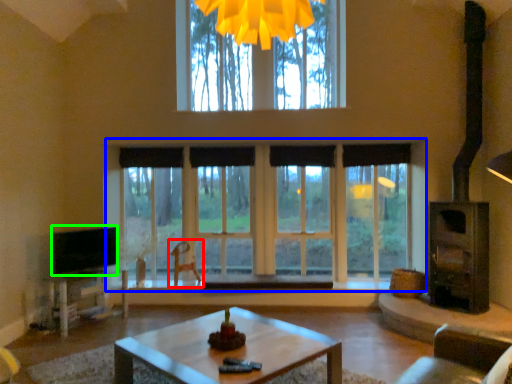
Question: Based on their relative distances, which object is farther from swivel chair (highlighted by a red box)? Choose from window (highlighted by a blue box) and level (highlighted by a green box).

Choices:
 (A) window
 (B) level

Answer: (A)